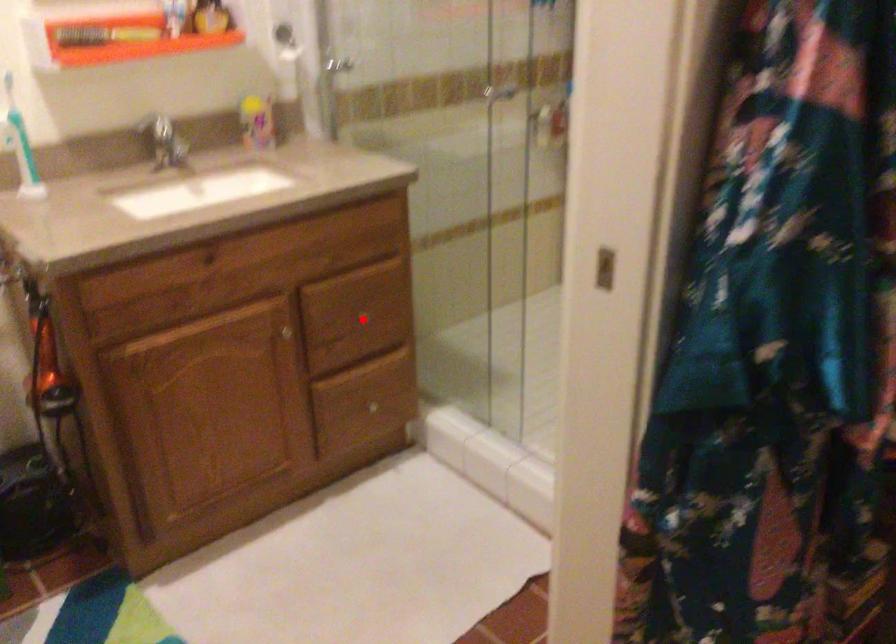
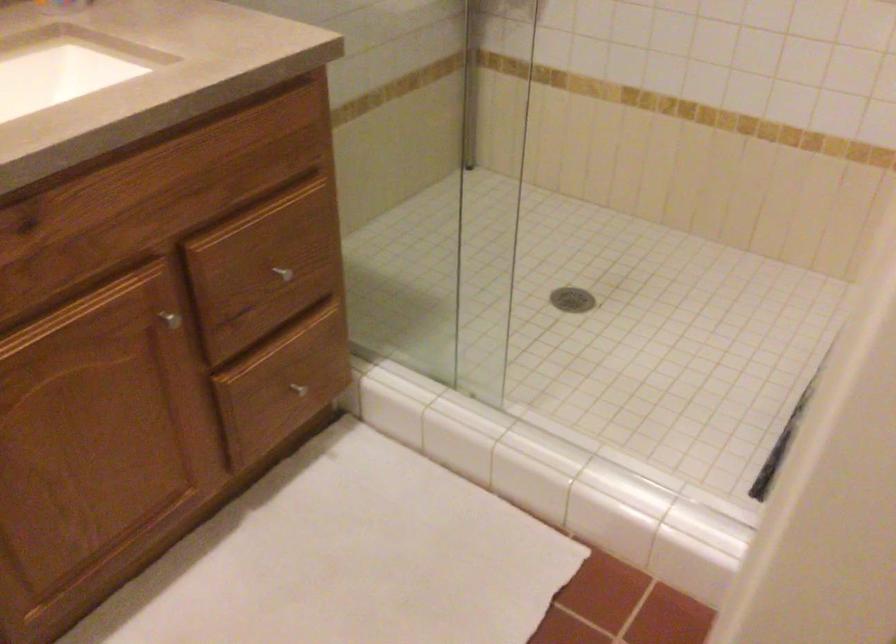
Question: A red point is marked in image1. In image2, is the corresponding 3D point closer to the camera or farther? Reply with the corresponding letter.

Choices:
 (A) The corresponding 3D point is closer.
 (B) The corresponding 3D point is farther.

Answer: (A)